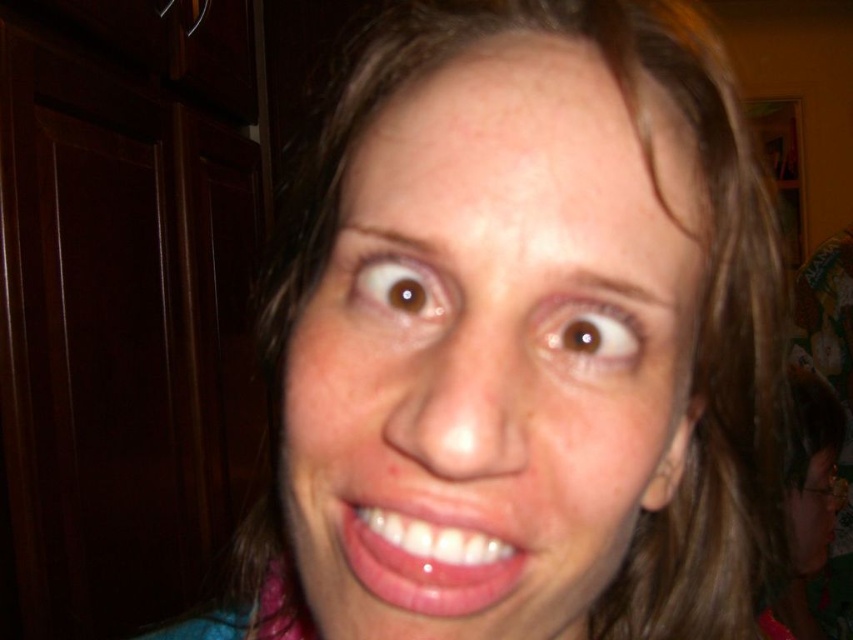
You are a photographer trying to focus on the natural skin tone at center and the glossy pink lips at center in this candid shot. Which object should you adjust your focus to first if you want to ensure both are in sharp focus?

The natural skin tone at center is in front of the glossy pink lips at center, so you should focus on the natural skin tone at center first to ensure both are in sharp focus.

You are taking a photo of two points in the scene. The first point is at point [639,188] and the second point is at point [376,556]. Which point is closer to you?

Point [639,188] is further to the viewer than point [376,556], so the second point is closer to you.